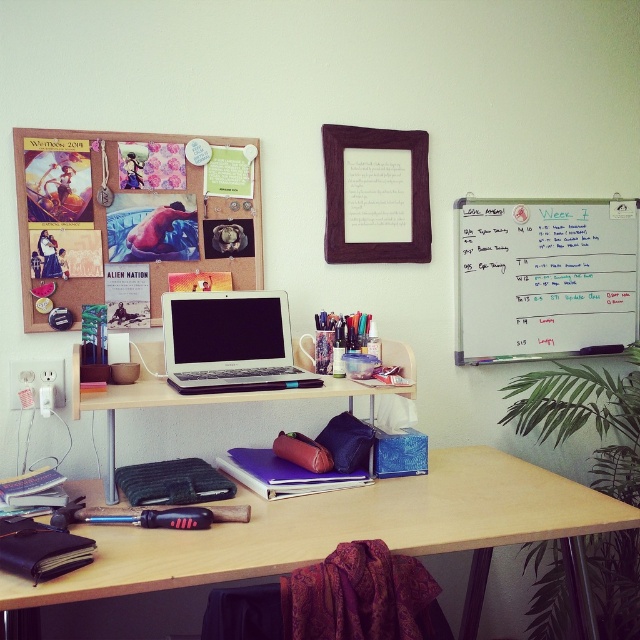
Question: Is the position of whiteboard at upper right more distant than that of sleek silver laptop at center?

Choices:
 (A) no
 (B) yes

Answer: (B)

Question: Estimate the real-world distances between objects in this image. Which object is farther from the whiteboard at upper right?

Choices:
 (A) sleek silver laptop at center
 (B) matte black laptop at center
 (C) wooden desk at center

Answer: (A)

Question: Is wooden desk at center above whiteboard at upper right?

Choices:
 (A) no
 (B) yes

Answer: (A)

Question: Which of the following is the farthest from the observer?

Choices:
 (A) (216, 529)
 (B) (428, 253)

Answer: (B)

Question: Which is farther from the sleek silver laptop at center?

Choices:
 (A) matte black laptop at center
 (B) whiteboard at upper right
 (C) purple fabric picture frame at upper center

Answer: (B)

Question: Can you confirm if whiteboard at upper right is positioned to the left of sleek silver laptop at center?

Choices:
 (A) no
 (B) yes

Answer: (A)